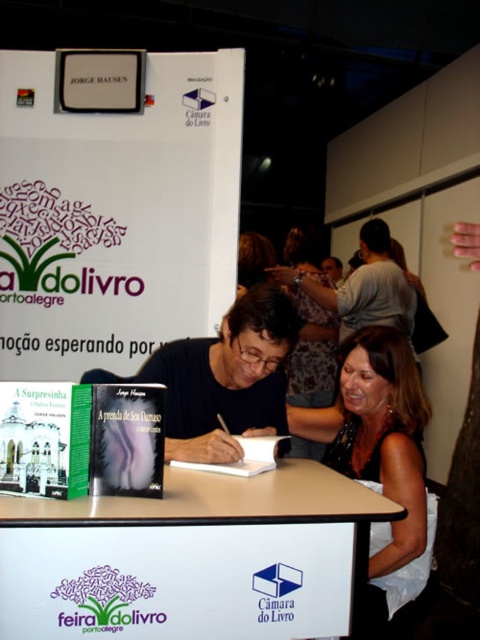
Question: Among these points, which one is nearest to the camera?

Choices:
 (A) [x=165, y=260]
 (B) [x=420, y=497]

Answer: (B)

Question: Can you confirm if white wood table at center is positioned above matte black dress at center?

Choices:
 (A) no
 (B) yes

Answer: (A)

Question: Which object is positioned closest to the matte black dress at center?

Choices:
 (A) white paperboard at upper center
 (B) white wood table at center

Answer: (B)

Question: Estimate the real-world distances between objects in this image. Which object is farther from the white paperboard at upper center?

Choices:
 (A) white wood table at center
 (B) matte black dress at center

Answer: (A)

Question: Can you confirm if white wood table at center is wider than matte black dress at center?

Choices:
 (A) yes
 (B) no

Answer: (A)

Question: Can you confirm if white paperboard at upper center is wider than white wood table at center?

Choices:
 (A) yes
 (B) no

Answer: (A)